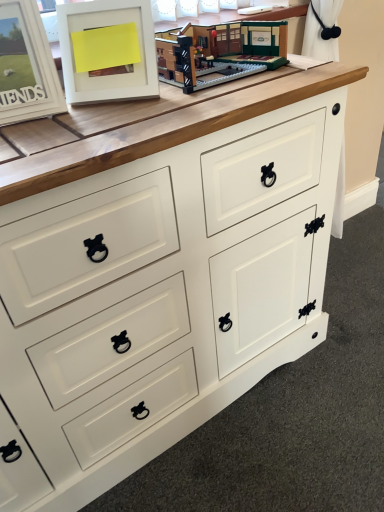
Where is `free space above brick-like lego set at upper center (from a real-world perspective)`? This screenshot has width=384, height=512. free space above brick-like lego set at upper center (from a real-world perspective) is located at coordinates (201, 28).